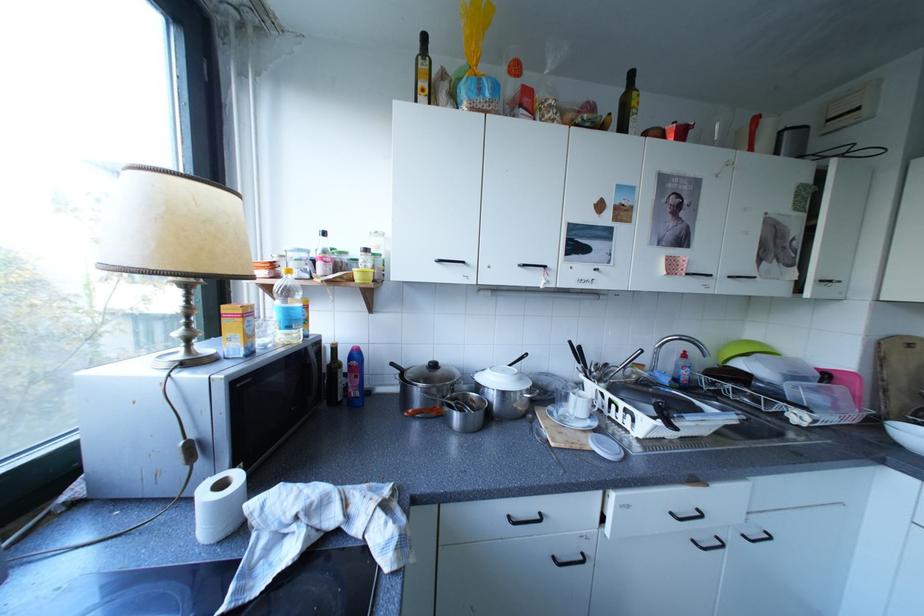
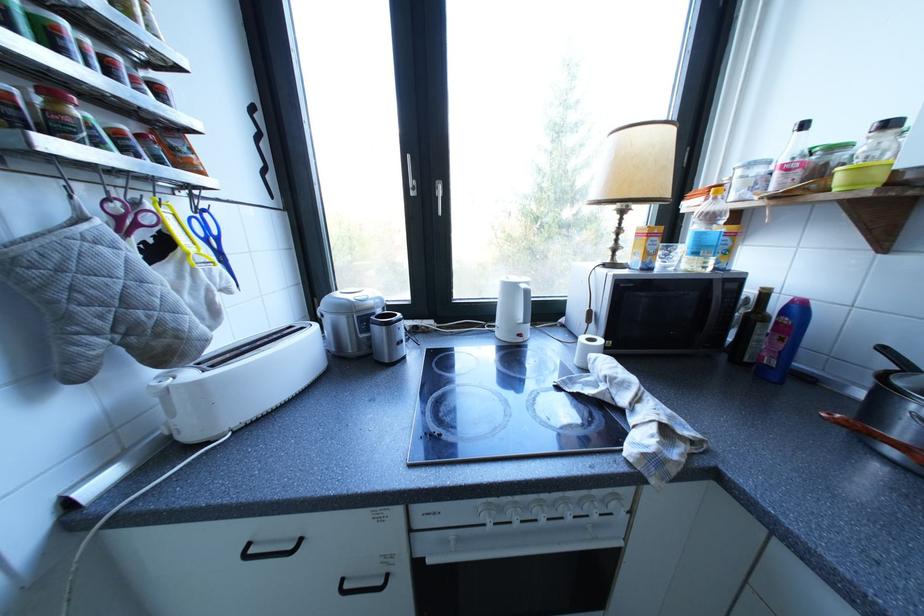
Find the pixel in the second image that matches (x=322, y=365) in the first image.

(723, 301)